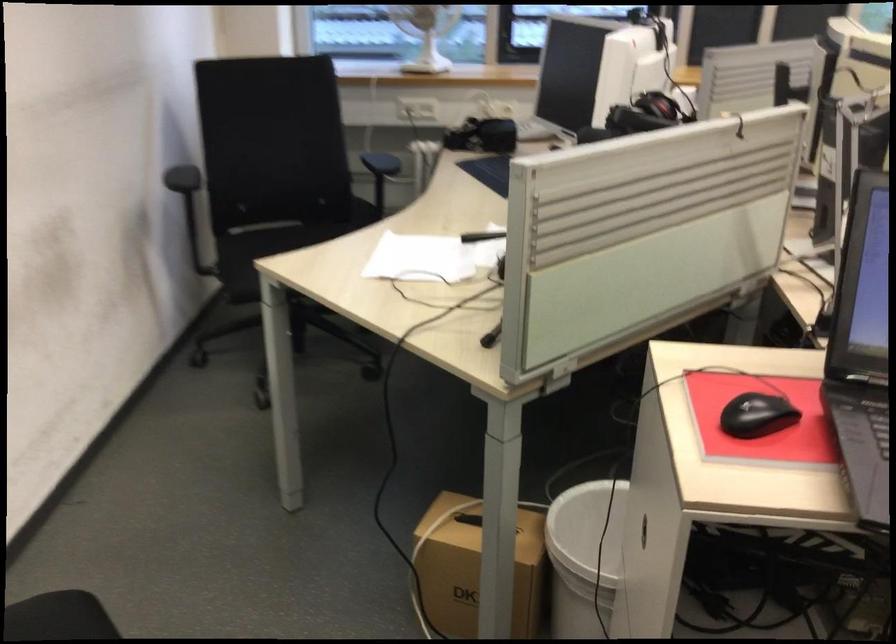
This screenshot has height=644, width=896. What do you see at coordinates (584, 556) in the screenshot? I see `the white plastic bucket` at bounding box center [584, 556].